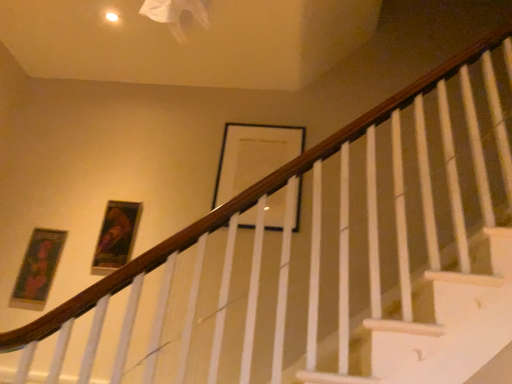
Find the location of `matte gold picture frame at left, which is the third picture frame from right to left`. matte gold picture frame at left, which is the third picture frame from right to left is located at coordinates (38, 269).

Where is `wooden framed portrait at upper left, which ranks as the 2th picture frame in right-to-left order`? wooden framed portrait at upper left, which ranks as the 2th picture frame in right-to-left order is located at coordinates (116, 236).

Image resolution: width=512 pixels, height=384 pixels. Describe the element at coordinates (116, 236) in the screenshot. I see `wooden framed portrait at upper left, which appears as the 2th picture frame when viewed from the left` at that location.

What is the approximate height of black matte picture frame at upper center, which is counted as the third picture frame, starting from the left?

The height of black matte picture frame at upper center, which is counted as the third picture frame, starting from the left, is 28.80 inches.

Find the location of a particular element. This screenshot has height=384, width=512. matte gold picture frame at left, which is the third picture frame from right to left is located at coordinates (38, 269).

How distant is wooden framed portrait at upper left, which appears as the 2th picture frame when viewed from the left, from matte gold picture frame at left, the first picture frame in the left-to-right sequence?

They are 12.66 inches apart.

Find the location of a particular element. This screenshot has width=512, height=384. picture frame that is in front of the wooden framed portrait at upper left, which ranks as the 2th picture frame in right-to-left order is located at coordinates (38, 269).

Can you confirm if wooden framed portrait at upper left, which ranks as the 2th picture frame in right-to-left order, is taller than matte gold picture frame at left, which is the third picture frame from right to left?

No.

Is wooden framed portrait at upper left, which appears as the 2th picture frame when viewed from the left, further to the viewer compared to matte gold picture frame at left, the first picture frame in the left-to-right sequence?

Yes, wooden framed portrait at upper left, which appears as the 2th picture frame when viewed from the left, is behind matte gold picture frame at left, the first picture frame in the left-to-right sequence.

Is black matte picture frame at upper center, which is counted as the third picture frame, starting from the left, further to the viewer compared to matte gold picture frame at left, which is the third picture frame from right to left?

Yes, black matte picture frame at upper center, which is counted as the third picture frame, starting from the left, is behind matte gold picture frame at left, which is the third picture frame from right to left.

The width and height of the screenshot is (512, 384). I want to click on picture frame that is the 2nd one below the black matte picture frame at upper center, which is counted as the third picture frame, starting from the left (from a real-world perspective), so click(38, 269).

Based on the photo, would you consider black matte picture frame at upper center, which is counted as the third picture frame, starting from the left, to be distant from matte gold picture frame at left, which is the third picture frame from right to left?

That's right, there is a large distance between black matte picture frame at upper center, which is counted as the third picture frame, starting from the left, and matte gold picture frame at left, which is the third picture frame from right to left.

Is point (254, 173) closer or farther from the camera than point (51, 279)?

Clearly, point (254, 173) is more distant from the camera than point (51, 279).

From a real-world perspective, is matte gold picture frame at left, the first picture frame in the left-to-right sequence, on top of black matte picture frame at upper center, which is counted as the third picture frame, starting from the left?

Incorrect, from a real-world perspective, matte gold picture frame at left, the first picture frame in the left-to-right sequence, is lower than black matte picture frame at upper center, which is counted as the third picture frame, starting from the left.

Is matte gold picture frame at left, the first picture frame in the left-to-right sequence, positioned beyond the bounds of black matte picture frame at upper center, which appears as the 1th picture frame when viewed from the right?

That's correct, matte gold picture frame at left, the first picture frame in the left-to-right sequence, is outside of black matte picture frame at upper center, which appears as the 1th picture frame when viewed from the right.

Is matte gold picture frame at left, the first picture frame in the left-to-right sequence, in front of or behind black matte picture frame at upper center, which is counted as the third picture frame, starting from the left, in the image?

matte gold picture frame at left, the first picture frame in the left-to-right sequence, is in front of black matte picture frame at upper center, which is counted as the third picture frame, starting from the left.

Does matte gold picture frame at left, the first picture frame in the left-to-right sequence, have a lesser height compared to black matte picture frame at upper center, which is counted as the third picture frame, starting from the left?

Yes, matte gold picture frame at left, the first picture frame in the left-to-right sequence, is shorter than black matte picture frame at upper center, which is counted as the third picture frame, starting from the left.

From a real-world perspective, who is located lower, wooden framed portrait at upper left, which ranks as the 2th picture frame in right-to-left order, or black matte picture frame at upper center, which is counted as the third picture frame, starting from the left?

In real-world perspective, wooden framed portrait at upper left, which ranks as the 2th picture frame in right-to-left order, is lower.

Which object is wider, wooden framed portrait at upper left, which appears as the 2th picture frame when viewed from the left, or black matte picture frame at upper center, which appears as the 1th picture frame when viewed from the right?

Wider between the two is black matte picture frame at upper center, which appears as the 1th picture frame when viewed from the right.

Does wooden framed portrait at upper left, which ranks as the 2th picture frame in right-to-left order, appear on the right side of black matte picture frame at upper center, which is counted as the third picture frame, starting from the left?

No, wooden framed portrait at upper left, which ranks as the 2th picture frame in right-to-left order, is not to the right of black matte picture frame at upper center, which is counted as the third picture frame, starting from the left.

From the picture: Is black matte picture frame at upper center, which is counted as the third picture frame, starting from the left, wider or thinner than wooden framed portrait at upper left, which ranks as the 2th picture frame in right-to-left order?

black matte picture frame at upper center, which is counted as the third picture frame, starting from the left, is wider than wooden framed portrait at upper left, which ranks as the 2th picture frame in right-to-left order.

Which object is further away from the camera, black matte picture frame at upper center, which is counted as the third picture frame, starting from the left, or wooden framed portrait at upper left, which ranks as the 2th picture frame in right-to-left order?

black matte picture frame at upper center, which is counted as the third picture frame, starting from the left, is further from the camera.

Which is more to the right, black matte picture frame at upper center, which is counted as the third picture frame, starting from the left, or wooden framed portrait at upper left, which ranks as the 2th picture frame in right-to-left order?

From the viewer's perspective, black matte picture frame at upper center, which is counted as the third picture frame, starting from the left, appears more on the right side.

Looking at their sizes, would you say matte gold picture frame at left, the first picture frame in the left-to-right sequence, is wider or thinner than wooden framed portrait at upper left, which appears as the 2th picture frame when viewed from the left?

Result: Considering their sizes, matte gold picture frame at left, the first picture frame in the left-to-right sequence, looks slimmer than wooden framed portrait at upper left, which appears as the 2th picture frame when viewed from the left.

From a real-world perspective, is matte gold picture frame at left, the first picture frame in the left-to-right sequence, located higher than wooden framed portrait at upper left, which appears as the 2th picture frame when viewed from the left?

No, from a real-world perspective, matte gold picture frame at left, the first picture frame in the left-to-right sequence, is not over wooden framed portrait at upper left, which appears as the 2th picture frame when viewed from the left

From a real-world perspective, starting from the matte gold picture frame at left, the first picture frame in the left-to-right sequence, which picture frame is the 1st one vertically above it? Please provide its 2D coordinates.

[(116, 236)]

Which picture frame is the 2nd one when counting from the right side of the matte gold picture frame at left, which is the third picture frame from right to left? Please provide its 2D coordinates.

[(253, 156)]

Looking at the image, which one is located further to matte gold picture frame at left, which is the third picture frame from right to left, wooden framed portrait at upper left, which appears as the 2th picture frame when viewed from the left, or black matte picture frame at upper center, which is counted as the third picture frame, starting from the left?

Among the two, black matte picture frame at upper center, which is counted as the third picture frame, starting from the left, is located further to matte gold picture frame at left, which is the third picture frame from right to left.

When comparing their distances from matte gold picture frame at left, which is the third picture frame from right to left, does black matte picture frame at upper center, which is counted as the third picture frame, starting from the left, or wooden framed portrait at upper left, which appears as the 2th picture frame when viewed from the left, seem closer?

The object closer to matte gold picture frame at left, which is the third picture frame from right to left, is wooden framed portrait at upper left, which appears as the 2th picture frame when viewed from the left.

Looking at the image, which one is located further to black matte picture frame at upper center, which is counted as the third picture frame, starting from the left, wooden framed portrait at upper left, which appears as the 2th picture frame when viewed from the left, or matte gold picture frame at left, the first picture frame in the left-to-right sequence?

Among the two, matte gold picture frame at left, the first picture frame in the left-to-right sequence, is located further to black matte picture frame at upper center, which is counted as the third picture frame, starting from the left.

Estimate the real-world distances between objects in this image. Which object is further from wooden framed portrait at upper left, which appears as the 2th picture frame when viewed from the left, matte gold picture frame at left, the first picture frame in the left-to-right sequence, or black matte picture frame at upper center, which is counted as the third picture frame, starting from the left?

black matte picture frame at upper center, which is counted as the third picture frame, starting from the left.

When comparing their distances from wooden framed portrait at upper left, which appears as the 2th picture frame when viewed from the left, does black matte picture frame at upper center, which appears as the 1th picture frame when viewed from the right, or matte gold picture frame at left, the first picture frame in the left-to-right sequence, seem closer?

matte gold picture frame at left, the first picture frame in the left-to-right sequence.

Which object lies nearer to the anchor point black matte picture frame at upper center, which appears as the 1th picture frame when viewed from the right, matte gold picture frame at left, which is the third picture frame from right to left, or wooden framed portrait at upper left, which appears as the 2th picture frame when viewed from the left?

wooden framed portrait at upper left, which appears as the 2th picture frame when viewed from the left.

At what (x,y) coordinates should I click in order to perform the action: click on picture frame located between matte gold picture frame at left, which is the third picture frame from right to left, and black matte picture frame at upper center, which is counted as the third picture frame, starting from the left, in the left-right direction. Please return your answer as a coordinate pair (x, y). Looking at the image, I should click on (116, 236).